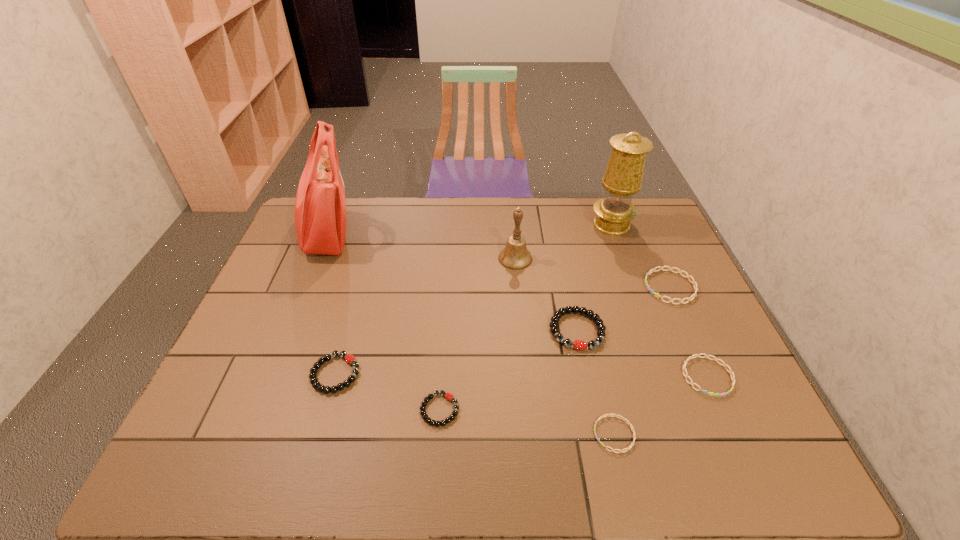
Locate an element on the screen. The image size is (960, 540). free spot that satisfies the following two spatial constraints: 1. on the front-facing side of the fifth nearest object; 2. on the right side of the handbag is located at coordinates (287, 330).

At what (x,y) coordinates should I click in order to perform the action: click on vacant region that satisfies the following two spatial constraints: 1. on the surface of the sixth nearest object showing star-shaped elements; 2. on the front side of the farthest black bracelet. Please return your answer as a coordinate pair (x, y). Image resolution: width=960 pixels, height=540 pixels. Looking at the image, I should click on (689, 330).